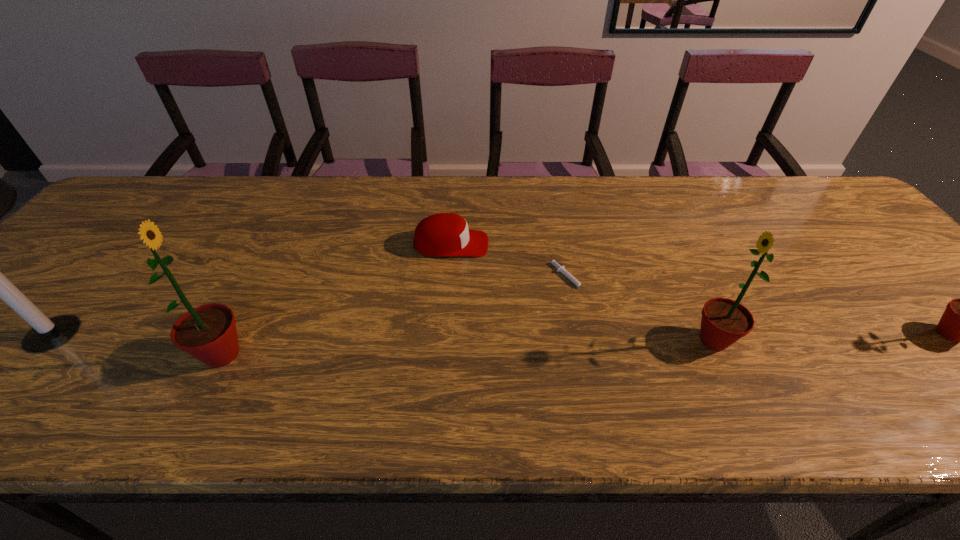
The width and height of the screenshot is (960, 540). I want to click on free space between the farthest object and the fourth shortest object, so click(x=583, y=292).

You are a GUI agent. You are given a task and a screenshot of the screen. Output one action in this format:
    pyautogui.click(x=<x>, y=<y>)
    Task: Click on the vacant point located between the second shortest sunflower and the fifth object from right to left
    The height and width of the screenshot is (540, 960).
    Given the screenshot: What is the action you would take?
    pyautogui.click(x=468, y=347)

Point out which object is positioned as the third nearest to the third tallest object. Please provide its 2D coordinates. Your answer should be formatted as a tuple, i.e. [(x, y)], where the tuple contains the x and y coordinates of a point satisfying the conditions above.

[(444, 234)]

Choose which object is the fourth nearest neighbor to the rightmost sunflower. Please provide its 2D coordinates. Your answer should be formatted as a tuple, i.e. [(x, y)], where the tuple contains the x and y coordinates of a point satisfying the conditions above.

[(208, 333)]

The height and width of the screenshot is (540, 960). Find the location of `sunflower that can be found as the second closest to the tallest object`. sunflower that can be found as the second closest to the tallest object is located at coordinates (724, 321).

Identify which sunflower is the third closest to the leftmost object. Please provide its 2D coordinates. Your answer should be formatted as a tuple, i.e. [(x, y)], where the tuple contains the x and y coordinates of a point satisfying the conditions above.

[(959, 323)]

This screenshot has width=960, height=540. In order to click on free location that satisfies the following two spatial constraints: 1. on the front-facing side of the farthest object; 2. on the back side of the syringe in this screenshot , I will do `click(448, 279)`.

In order to click on free location that satisfies the following two spatial constraints: 1. on the front-facing side of the farthest object; 2. on the back side of the shortest object in this screenshot , I will do `click(448, 279)`.

This screenshot has width=960, height=540. In order to click on free spot that satisfies the following two spatial constraints: 1. on the back side of the third object from right to left; 2. on the front-facing side of the baseball cap in this screenshot , I will do `click(563, 244)`.